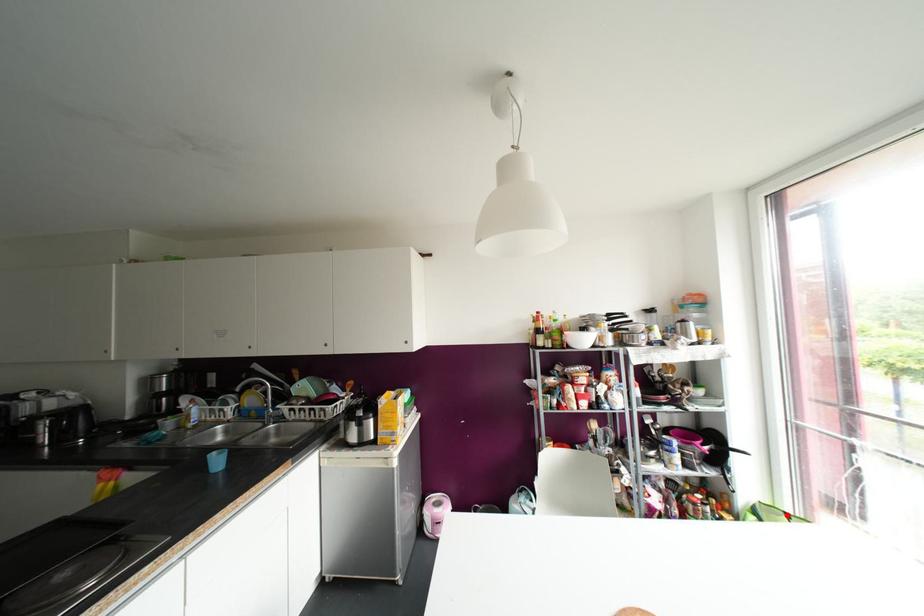
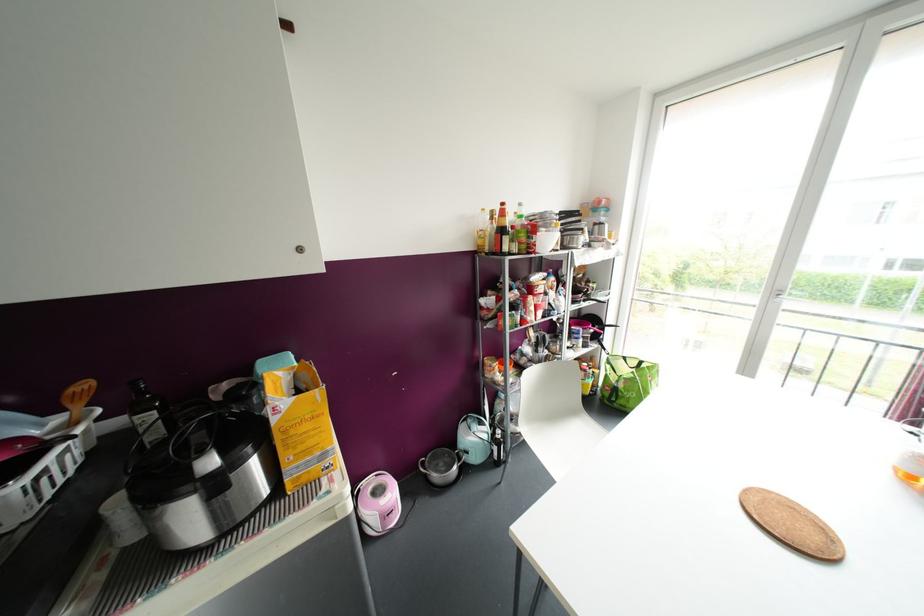
In the second image, find the point that corresponds to the highlighted location in the first image.

(624, 358)